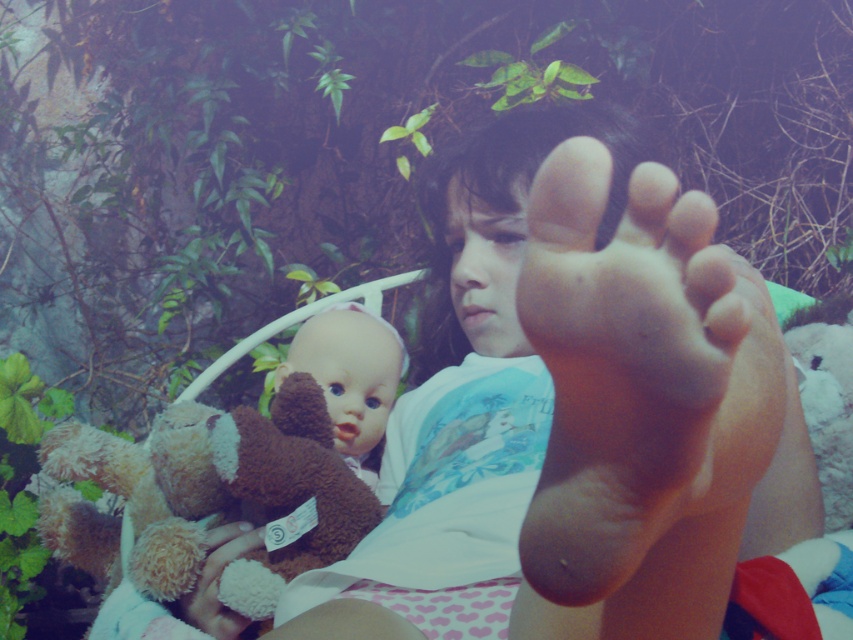
Question: Can you confirm if matte skin foot at center is smaller than skinny flesh-toned foot at center?

Choices:
 (A) yes
 (B) no

Answer: (B)

Question: Which of the following is the farthest from the observer?

Choices:
 (A) (186, 449)
 (B) (202, 568)

Answer: (A)

Question: Does fuzzy brown teddy bear at lower left lie behind brown plush bear at center?

Choices:
 (A) yes
 (B) no

Answer: (B)

Question: Which is nearer to the matte skin foot at center?

Choices:
 (A) fuzzy brown teddy bear at lower left
 (B) brown plush bear at center
 (C) fluffy brown teddy bear at lower left
 (D) skinny flesh-toned foot at center

Answer: (B)

Question: Which point appears farthest from the camera in this image?

Choices:
 (A) (718, 353)
 (B) (219, 625)
 (C) (357, 417)

Answer: (C)

Question: Can you confirm if fuzzy brown teddy bear at lower left is positioned to the left of fluffy brown teddy bear at lower left?

Choices:
 (A) no
 (B) yes

Answer: (B)